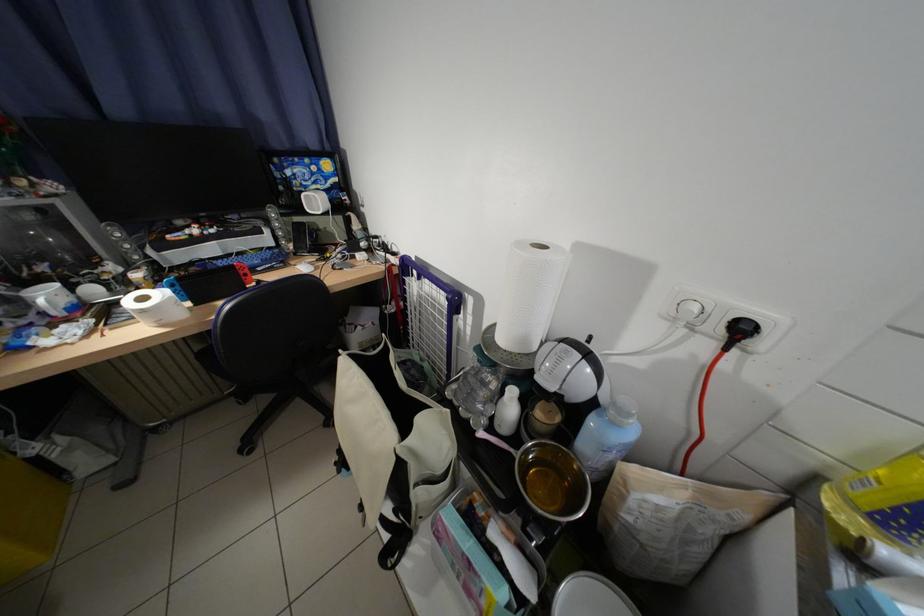
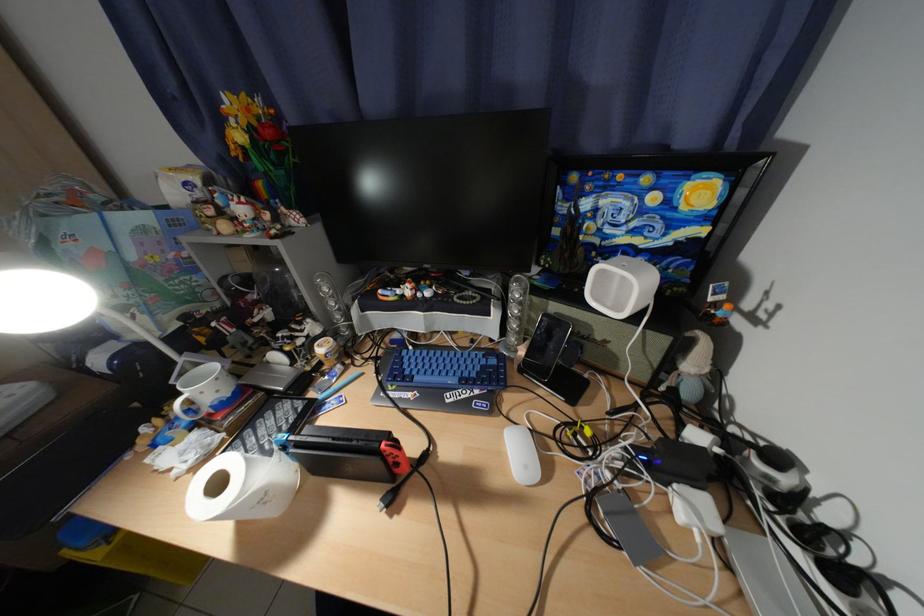
Where in the second image is the point corresponding to pixel 368 228 from the first image?

(704, 367)